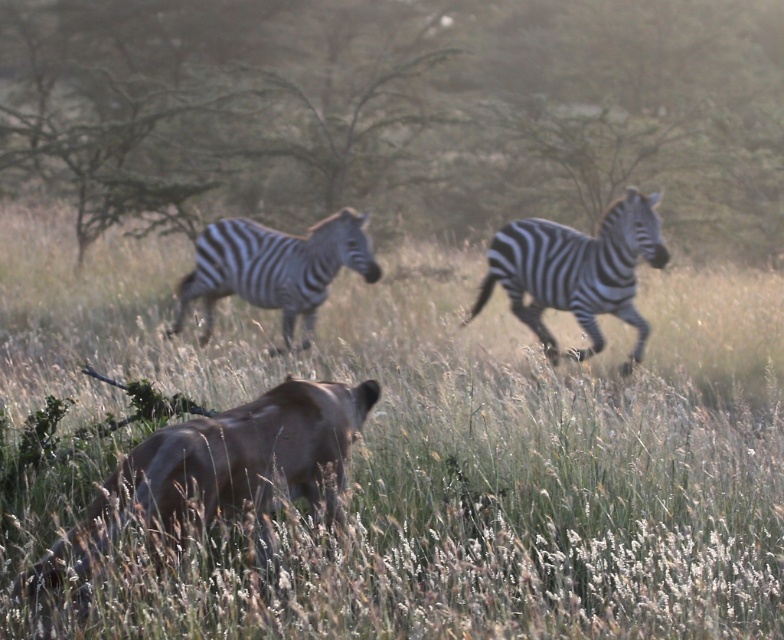
Is green leafy tree at upper center taller than black and white striped zebra at right?

Yes.

I want to click on green leafy tree at upper center, so click(x=398, y=109).

Where is `green leafy tree at upper center`? The height and width of the screenshot is (640, 784). green leafy tree at upper center is located at coordinates (398, 109).

The height and width of the screenshot is (640, 784). Identify the location of green leafy tree at upper center. (398, 109).

Which is in front, point (240, 323) or point (249, 433)?

Positioned in front is point (249, 433).

Who is taller, green grassy at center or brown fur antelope at lower left?

Standing taller between the two is green grassy at center.

Where is `green grassy at center`? The width and height of the screenshot is (784, 640). green grassy at center is located at coordinates (408, 452).

Find the location of a particular element. The image size is (784, 640). green grassy at center is located at coordinates (408, 452).

Can you confirm if brown fur antelope at lower left is wider than black and white striped zebra at right?

No, brown fur antelope at lower left is not wider than black and white striped zebra at right.

From the picture: Which is below, brown fur antelope at lower left or black and white striped zebra at right?

brown fur antelope at lower left

Image resolution: width=784 pixels, height=640 pixels. I want to click on brown fur antelope at lower left, so click(x=224, y=467).

Where is `brown fur antelope at lower left`? brown fur antelope at lower left is located at coordinates (224, 467).